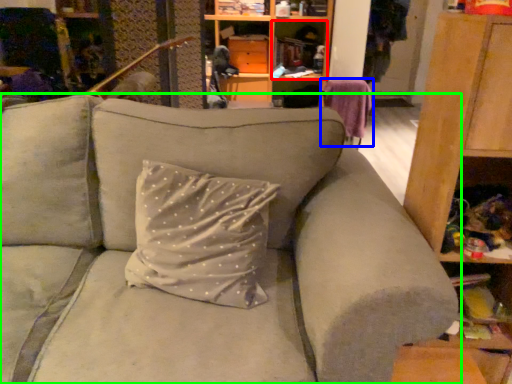
Question: Which is farther away from cabinet (highlighted by a red box)? swivel chair (highlighted by a blue box) or studio couch (highlighted by a green box)?

Choices:
 (A) swivel chair
 (B) studio couch

Answer: (B)